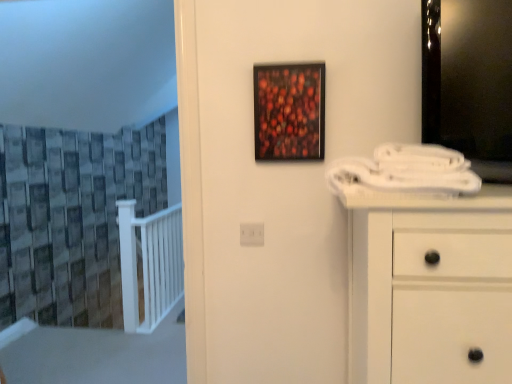
Question: Is textured gray curtain at left taller or shorter than wooden-framed artwork at center?

Choices:
 (A) short
 (B) tall

Answer: (B)

Question: Is point (66, 316) closer or farther from the camera than point (321, 109)?

Choices:
 (A) farther
 (B) closer

Answer: (A)

Question: Considering the real-world distances, which object is farthest from the wooden-framed artwork at center?

Choices:
 (A) white plastic electric outlet at center
 (B) textured gray curtain at left

Answer: (B)

Question: Estimate the real-world distances between objects in this image. Which object is farther from the textured gray curtain at left?

Choices:
 (A) white plastic electric outlet at center
 (B) wooden-framed artwork at center

Answer: (A)